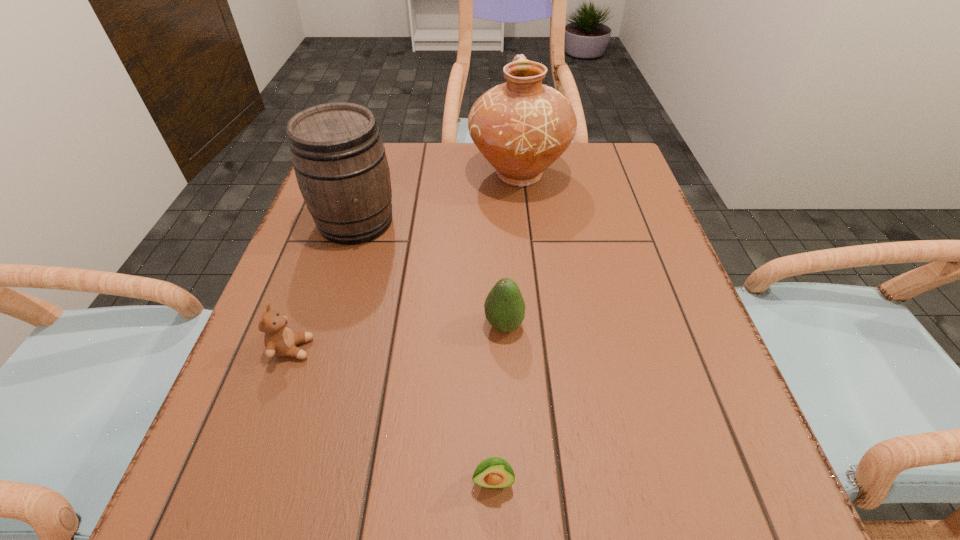
Locate an element on the screen. The width and height of the screenshot is (960, 540). vacant area that lies between the teddy bear and the pottery is located at coordinates (405, 261).

You are a GUI agent. You are given a task and a screenshot of the screen. Output one action in this format:
    pyautogui.click(x=<x>, y=<y>)
    Task: Click on the vacant space that is in between the teddy bear and the pottery
    
    Given the screenshot: What is the action you would take?
    pyautogui.click(x=405, y=261)

Identify the location of free area in between the teddy bear and the pottery. pyautogui.click(x=405, y=261).

Locate an element on the screen. The image size is (960, 540). free area in between the farther avocado and the pottery is located at coordinates (511, 249).

Where is `vacant area between the taller avocado and the teddy bear`? The width and height of the screenshot is (960, 540). vacant area between the taller avocado and the teddy bear is located at coordinates (398, 336).

The width and height of the screenshot is (960, 540). In order to click on free spot between the farther avocado and the teddy bear in this screenshot , I will do `click(398, 336)`.

Locate an element on the screen. The image size is (960, 540). free spot between the teddy bear and the pottery is located at coordinates (405, 261).

Select which object appears as the third closest to the shortest object. Please provide its 2D coordinates. Your answer should be formatted as a tuple, i.e. [(x, y)], where the tuple contains the x and y coordinates of a point satisfying the conditions above.

[(339, 159)]

The image size is (960, 540). What are the coordinates of `object that is the fourth closest one to the farther avocado` in the screenshot? It's located at (521, 127).

This screenshot has width=960, height=540. What are the coordinates of `vacant space that satisfies the following two spatial constraints: 1. on the front side of the farther avocado; 2. on the front-facing side of the teddy bear` in the screenshot? It's located at (505, 349).